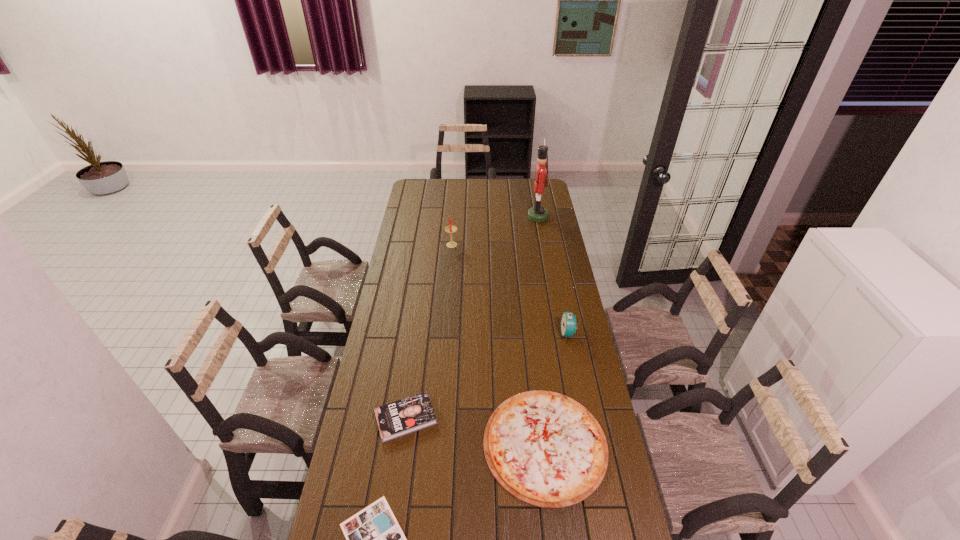
You are a GUI agent. You are given a task and a screenshot of the screen. Output one action in this format:
    pyautogui.click(x=<x>, y=<y>)
    Task: Click on the vacant space situated on the front-facing side of the nutcracker
    The height and width of the screenshot is (540, 960).
    Given the screenshot: What is the action you would take?
    pyautogui.click(x=462, y=217)

The width and height of the screenshot is (960, 540). Identify the location of free point located on the front-facing side of the nutcracker. (501, 217).

Locate an element on the screen. The image size is (960, 540). vacant region located 0.180m on the right of the second farthest object is located at coordinates (492, 244).

Find the location of `vacant space located on the front-facing side of the third farthest object`. vacant space located on the front-facing side of the third farthest object is located at coordinates (479, 333).

This screenshot has width=960, height=540. In order to click on vacant region located on the front-facing side of the third farthest object in this screenshot , I will do `click(469, 333)`.

In order to click on free space located on the front-facing side of the third farthest object in this screenshot , I will do `click(479, 333)`.

Locate an element on the screen. free space located on the right of the fourth tallest object is located at coordinates (498, 418).

The height and width of the screenshot is (540, 960). What are the coordinates of `blank space located on the left of the fifth tallest object` in the screenshot? It's located at (411, 444).

Where is `object that is at the left edge`? object that is at the left edge is located at coordinates (408, 415).

This screenshot has height=540, width=960. In order to click on nutcracker positioned at the right edge in this screenshot , I will do `click(538, 213)`.